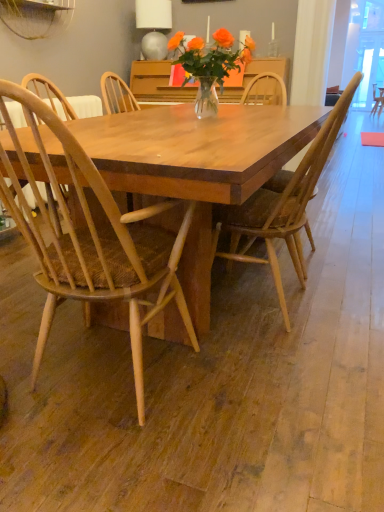
Question: Are natural wood chair at center, which is counted as the 2th chair, starting from the right, and wooden chair at center, the 2th chair in the left-to-right sequence, far apart?

Choices:
 (A) yes
 (B) no

Answer: (B)

Question: Does natural wood chair at center, which is the 1th chair in left-to-right order, turn towards wooden chair at center, which is counted as the 1th chair, starting from the right?

Choices:
 (A) yes
 (B) no

Answer: (A)

Question: From the image's perspective, is natural wood chair at center, which is the 1th chair in left-to-right order, under wooden chair at center, the 2th chair in the left-to-right sequence?

Choices:
 (A) yes
 (B) no

Answer: (A)

Question: From a real-world perspective, does natural wood chair at center, which is the 1th chair in left-to-right order, sit lower than wooden chair at center, the 2th chair in the left-to-right sequence?

Choices:
 (A) yes
 (B) no

Answer: (A)

Question: Is the depth of natural wood chair at center, which is counted as the 2th chair, starting from the right, less than that of wooden chair at center, which is counted as the 1th chair, starting from the right?

Choices:
 (A) no
 (B) yes

Answer: (B)

Question: Is natural wood chair at center, which is the 1th chair in left-to-right order, not within wooden chair at center, which is counted as the 1th chair, starting from the right?

Choices:
 (A) yes
 (B) no

Answer: (A)

Question: Considering the relative sizes of matte gray lampshade at upper center and natural wood chair at center, which is the 1th chair in left-to-right order, in the image provided, is matte gray lampshade at upper center taller than natural wood chair at center, which is the 1th chair in left-to-right order,?

Choices:
 (A) no
 (B) yes

Answer: (A)

Question: Considering the relative positions of matte gray lampshade at upper center and natural wood chair at center, which is the 1th chair in left-to-right order, in the image provided, is matte gray lampshade at upper center to the right of natural wood chair at center, which is the 1th chair in left-to-right order, from the viewer's perspective?

Choices:
 (A) yes
 (B) no

Answer: (B)

Question: Is matte gray lampshade at upper center bigger than natural wood chair at center, which is the 1th chair in left-to-right order?

Choices:
 (A) yes
 (B) no

Answer: (B)

Question: Is matte gray lampshade at upper center smaller than natural wood chair at center, which is the 1th chair in left-to-right order?

Choices:
 (A) no
 (B) yes

Answer: (B)

Question: Is matte gray lampshade at upper center not inside natural wood chair at center, which is the 1th chair in left-to-right order?

Choices:
 (A) yes
 (B) no

Answer: (A)

Question: Considering the relative sizes of matte gray lampshade at upper center and natural wood chair at center, which is the 1th chair in left-to-right order, in the image provided, is matte gray lampshade at upper center thinner than natural wood chair at center, which is the 1th chair in left-to-right order,?

Choices:
 (A) yes
 (B) no

Answer: (A)

Question: Is wooden chair at center, the 2th chair in the left-to-right sequence, smaller than matte gray lampshade at upper center?

Choices:
 (A) yes
 (B) no

Answer: (B)